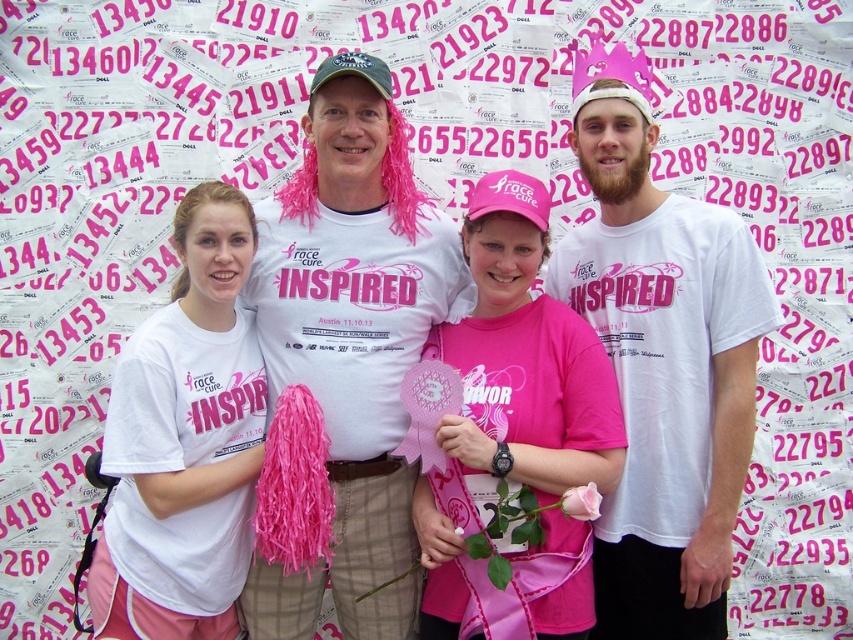
Which is behind, point (715, 515) or point (163, 416)?

Point (715, 515)

Find the location of a particular element. Image resolution: width=853 pixels, height=640 pixels. white t-shirt at center is located at coordinates (663, 371).

Identify the location of white t-shirt at center. Image resolution: width=853 pixels, height=640 pixels. (663, 371).

Between pink matte shirt at center and white matte t-shirt at center, which one has less height?

Standing shorter between the two is white matte t-shirt at center.

This screenshot has height=640, width=853. Describe the element at coordinates (515, 433) in the screenshot. I see `pink matte shirt at center` at that location.

At what (x,y) coordinates should I click in order to perform the action: click on pink matte shirt at center. Please return your answer as a coordinate pair (x, y). The image size is (853, 640). Looking at the image, I should click on (515, 433).

Does white t-shirt at center have a lesser height compared to pink matte shirt at center?

In fact, white t-shirt at center may be taller than pink matte shirt at center.

Is point (723, 461) behind point (555, 316)?

No, it is in front of (555, 316).

Locate an element on the screen. The width and height of the screenshot is (853, 640). white t-shirt at center is located at coordinates (663, 371).